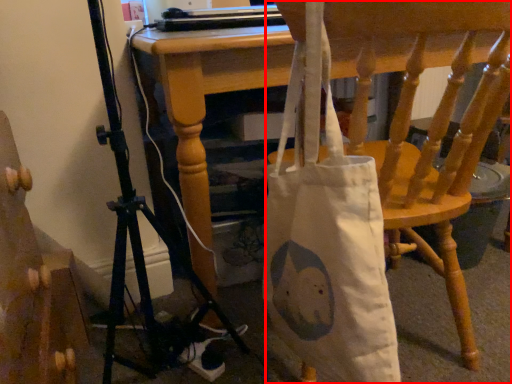
Question: From the image's perspective, what is the correct spatial relationship of chair (annotated by the red box) in relation to furniture?

Choices:
 (A) above
 (B) below

Answer: (A)